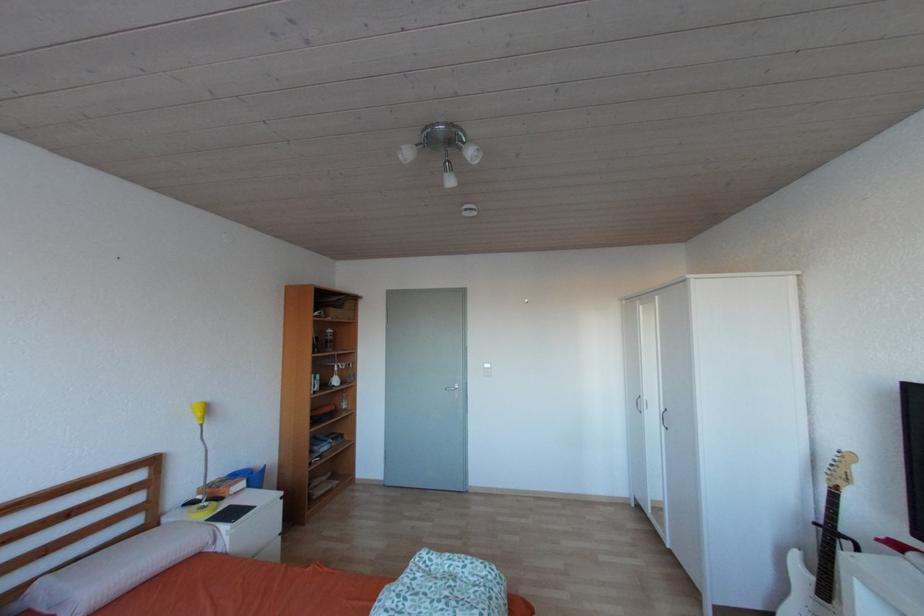
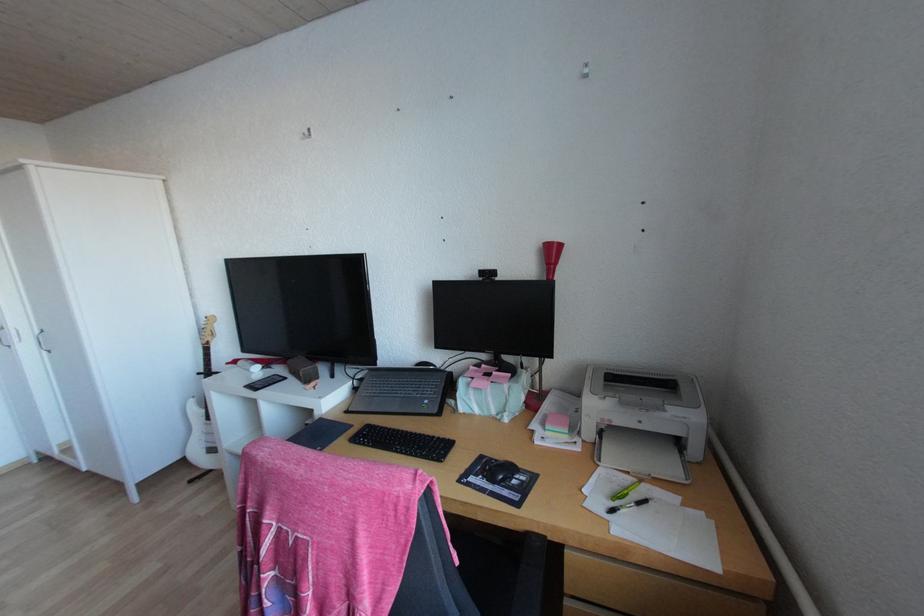
Question: Based on the continuous images, in which direction is the camera rotating? Reply with the corresponding letter.

Choices:
 (A) Left
 (B) Right
 (C) Up
 (D) Down

Answer: (B)